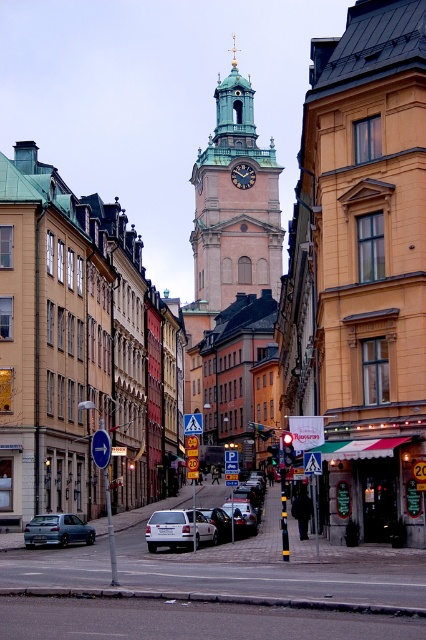
Question: Is blue plastic sign at left positioned in front of white matte car at center?

Choices:
 (A) yes
 (B) no

Answer: (A)

Question: Which point is closer to the camera?

Choices:
 (A) silver metallic car at center
 (B) white matte car at center
 (C) dark brown wooden clock at center
 (D) metallic blue hatchback at lower left

Answer: (D)

Question: Among these points, which one is farthest from the camera?

Choices:
 (A) (238, 164)
 (B) (60, 538)

Answer: (A)

Question: Among these objects, which one is farthest from the camera?

Choices:
 (A) silver metallic car at center
 (B) white matte car at center
 (C) metallic blue hatchback at lower left
 (D) silver metallic van at center

Answer: (B)

Question: From the image, what is the correct spatial relationship of green stone clock tower at center in relation to silver metallic van at center?

Choices:
 (A) above
 (B) below

Answer: (A)

Question: Is blue plastic sign at left to the right of blue plastic arrow at center from the viewer's perspective?

Choices:
 (A) no
 (B) yes

Answer: (A)